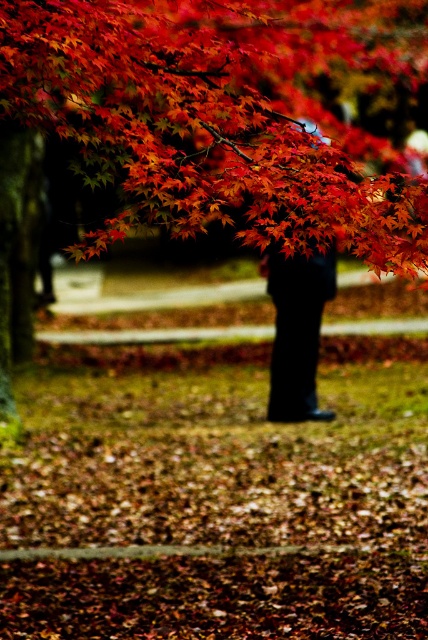
Can you confirm if shiny red maple leaves at upper center is wider than black matte pants at center?

Incorrect, shiny red maple leaves at upper center's width does not surpass black matte pants at center's.

Does shiny red maple leaves at upper center appear on the left side of black matte pants at center?

In fact, shiny red maple leaves at upper center is to the right of black matte pants at center.

Who is more forward, (x=177, y=99) or (x=332, y=285)?

Point (x=177, y=99)

At what (x,y) coordinates should I click in order to perform the action: click on shiny red maple leaves at upper center. Please return your answer as a coordinate pair (x, y). This screenshot has width=428, height=640. Looking at the image, I should click on (211, 120).